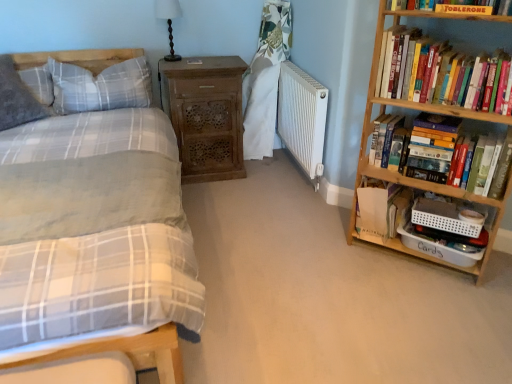
Question: From the image's perspective, is gray plaid pillow at upper left, marked as the first pillow in a right-to-left arrangement, under matte plaid bed at left?

Choices:
 (A) no
 (B) yes

Answer: (A)

Question: From a real-world perspective, is gray plaid pillow at upper left, marked as the first pillow in a right-to-left arrangement, under matte plaid bed at left?

Choices:
 (A) no
 (B) yes

Answer: (A)

Question: Is gray plaid pillow at upper left, which ranks as the second pillow in left-to-right order, not inside matte plaid bed at left?

Choices:
 (A) yes
 (B) no

Answer: (B)

Question: Can you confirm if gray plaid pillow at upper left, which ranks as the second pillow in left-to-right order, is taller than matte plaid bed at left?

Choices:
 (A) yes
 (B) no

Answer: (B)

Question: Is gray plaid pillow at upper left, marked as the first pillow in a right-to-left arrangement, bigger than matte plaid bed at left?

Choices:
 (A) yes
 (B) no

Answer: (B)

Question: Is black wood table lamp at upper center bigger or smaller than white fabric curtain at center?

Choices:
 (A) big
 (B) small

Answer: (B)

Question: Considering the relative positions of black wood table lamp at upper center and white fabric curtain at center in the image provided, is black wood table lamp at upper center to the left or to the right of white fabric curtain at center?

Choices:
 (A) left
 (B) right

Answer: (A)

Question: In the image, is black wood table lamp at upper center positioned in front of or behind white fabric curtain at center?

Choices:
 (A) behind
 (B) front

Answer: (B)

Question: From a real-world perspective, is black wood table lamp at upper center physically located above or below white fabric curtain at center?

Choices:
 (A) above
 (B) below

Answer: (A)

Question: Is soft gray pillow at upper left, placed as the 1th pillow when sorted from left to right, in front of or behind white paper bag at right, which is counted as the third book, starting from the top, in the image?

Choices:
 (A) front
 (B) behind

Answer: (B)

Question: Is soft gray pillow at upper left, placed as the 1th pillow when sorted from left to right, bigger or smaller than white paper bag at right, which is counted as the third book, starting from the top?

Choices:
 (A) big
 (B) small

Answer: (A)

Question: Considering the positions of point (10, 67) and point (376, 226), is point (10, 67) closer or farther from the camera than point (376, 226)?

Choices:
 (A) closer
 (B) farther

Answer: (B)

Question: From the image's perspective, relative to white paper bag at right, which is counted as the third book, starting from the top, is soft gray pillow at upper left, placed as the 1th pillow when sorted from left to right, above or below?

Choices:
 (A) above
 (B) below

Answer: (A)

Question: In terms of size, does soft gray pillow at upper left, placed as the 1th pillow when sorted from left to right, appear bigger or smaller than white fabric curtain at center?

Choices:
 (A) small
 (B) big

Answer: (A)

Question: From the image's perspective, is soft gray pillow at upper left, the 2th pillow viewed from the right, above or below white fabric curtain at center?

Choices:
 (A) below
 (B) above

Answer: (A)